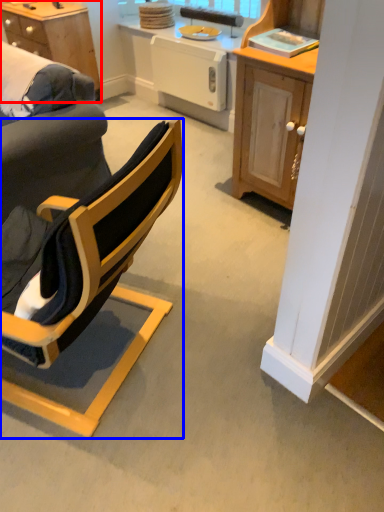
Question: Which object appears closest to the camera in this image, desk (highlighted by a red box) or chair (highlighted by a blue box)?

Choices:
 (A) desk
 (B) chair

Answer: (B)